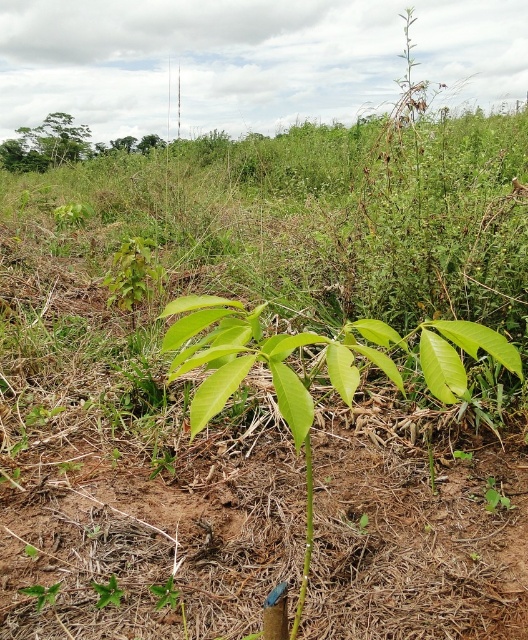
Question: Which object is closer to the camera taking this photo?

Choices:
 (A) green leafy tree at upper left
 (B) green glossy leaf at center

Answer: (B)

Question: Among these objects, which one is farthest from the camera?

Choices:
 (A) green glossy leaf at center
 (B) green leafy tree at upper left

Answer: (B)

Question: Which point appears closest to the camera in this image?

Choices:
 (A) (227, 348)
 (B) (70, 118)

Answer: (A)

Question: Is green glossy leaf at center above green leafy tree at upper left?

Choices:
 (A) no
 (B) yes

Answer: (A)

Question: Is green glossy leaf at center wider than green leafy tree at upper left?

Choices:
 (A) yes
 (B) no

Answer: (B)

Question: Can you confirm if green glossy leaf at center is positioned to the right of green leafy tree at upper left?

Choices:
 (A) no
 (B) yes

Answer: (B)